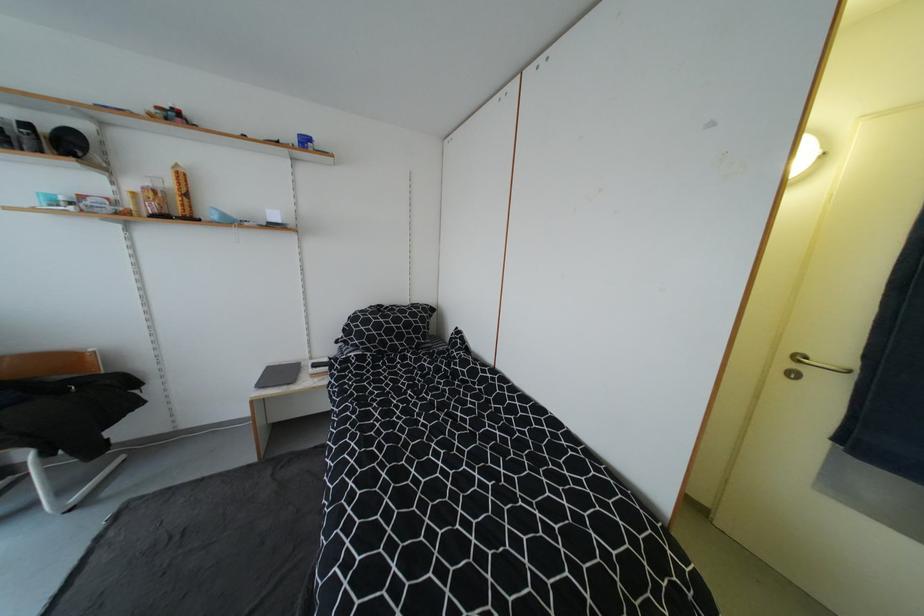
What do you see at coordinates (35, 411) in the screenshot? I see `the chair sitting surface` at bounding box center [35, 411].